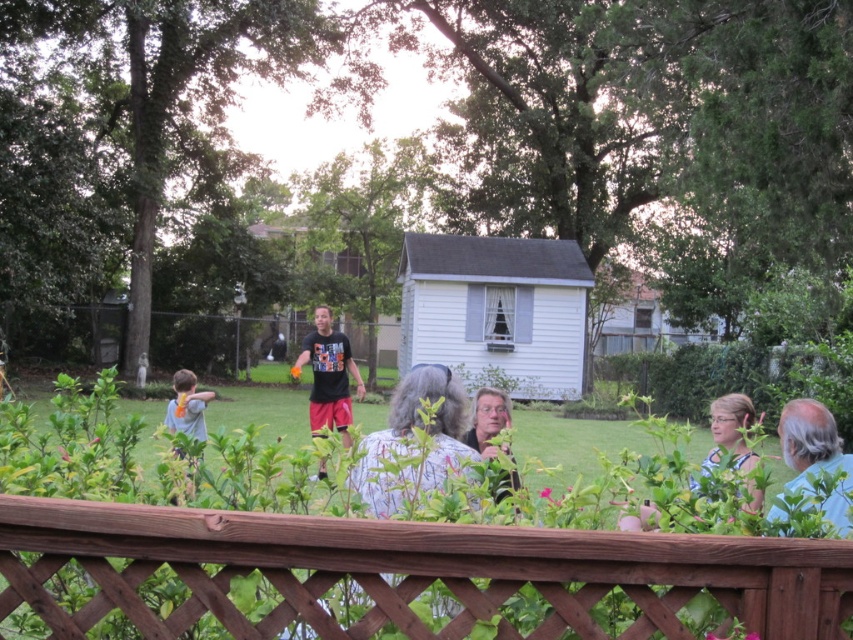
Question: Can you confirm if gray hair at upper right is positioned above light blue shirt at left?

Choices:
 (A) yes
 (B) no

Answer: (A)

Question: Is brown wooden fence at lower center bigger than wooden fence at center?

Choices:
 (A) yes
 (B) no

Answer: (B)

Question: Can you confirm if brown wooden fence at lower center is wider than light blue shirt at left?

Choices:
 (A) yes
 (B) no

Answer: (B)

Question: Which object appears closest to the camera in this image?

Choices:
 (A) light blue shirt at left
 (B) brown wooden fence at lower center
 (C) gray hair at upper right
 (D) wooden fence at center

Answer: (B)

Question: Among these points, which one is farthest from the camera?

Choices:
 (A) (834, 520)
 (B) (13, 323)
 (C) (199, 429)
 (D) (265, 536)

Answer: (B)

Question: Estimate the real-world distances between objects in this image. Which object is farther from the wooden fence at center?

Choices:
 (A) gray hair at upper right
 (B) light blue shirt at left
 (C) brown wooden fence at lower center

Answer: (C)